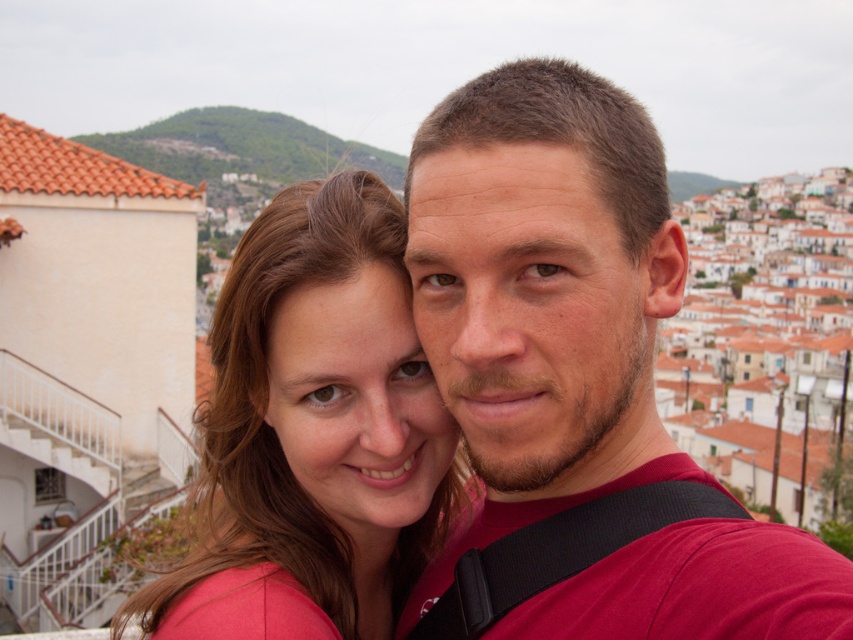
Can you confirm if matte red shirt at center is positioned below matte pink shirt at center?

Incorrect, matte red shirt at center is not positioned below matte pink shirt at center.

Which is below, matte red shirt at center or matte pink shirt at center?

matte pink shirt at center is below.

Who is more forward, (512, 147) or (349, 483)?

Point (512, 147) is more forward.

Image resolution: width=853 pixels, height=640 pixels. Find the location of `matte red shirt at center`. matte red shirt at center is located at coordinates (543, 291).